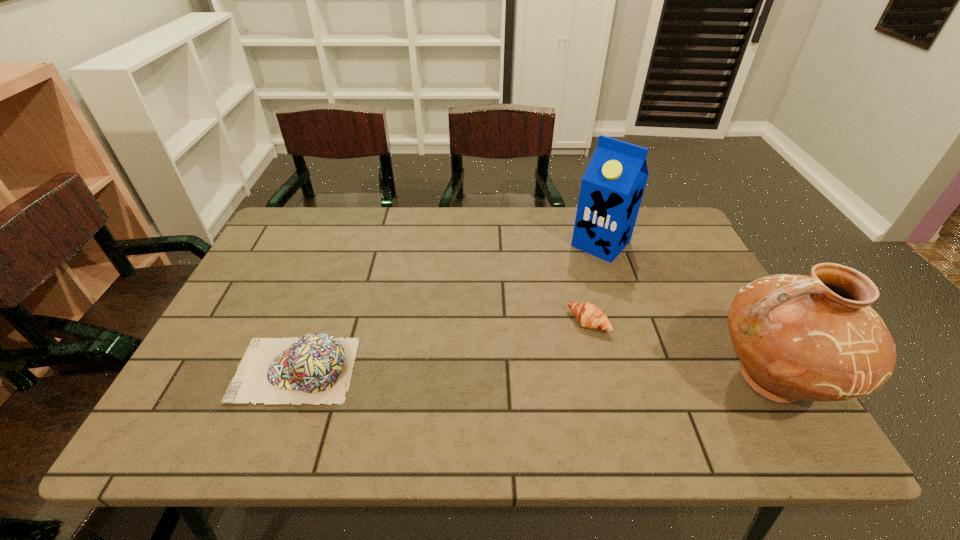
In order to click on the third tallest object in this screenshot , I will do `click(317, 368)`.

Find the location of `cap`. cap is located at coordinates coord(317,368).

At what (x,y) coordinates should I click in order to perform the action: click on pottery. Please return your answer as a coordinate pair (x, y). Image resolution: width=960 pixels, height=540 pixels. Looking at the image, I should click on (817, 338).

This screenshot has height=540, width=960. In order to click on carton in this screenshot , I will do `click(612, 188)`.

At what (x,y) coordinates should I click in order to perform the action: click on pastry. Please return your answer as a coordinate pair (x, y). Image resolution: width=960 pixels, height=540 pixels. Looking at the image, I should click on (588, 315).

At what (x,y) coordinates should I click in order to perform the action: click on vacant space located 0.090m on the front, side, and top of the second shortest object. Please return your answer as a coordinate pair (x, y). Looking at the image, I should click on (198, 370).

You are a GUI agent. You are given a task and a screenshot of the screen. Output one action in this format:
    pyautogui.click(x=<x>, y=<y>)
    Task: Click on the vacant space situated 0.350m on the side of the rightmost object with the handle
    Image resolution: width=960 pixels, height=540 pixels.
    Given the screenshot: What is the action you would take?
    pyautogui.click(x=550, y=380)

At what (x,y) coordinates should I click in order to perform the action: click on free location located on the side of the rightmost object with the handle. Please return your answer as a coordinate pair (x, y). Looking at the image, I should click on (533, 380).

You are a GUI agent. You are given a task and a screenshot of the screen. Output one action in this format:
    pyautogui.click(x=<x>, y=<y>)
    Task: Click on the blank space located 0.330m on the side of the rightmost object with the handle
    The width and height of the screenshot is (960, 540).
    Given the screenshot: What is the action you would take?
    pyautogui.click(x=560, y=380)

Identify the location of vacant region located with the cap open on the farthest object. This screenshot has height=540, width=960. (561, 286).